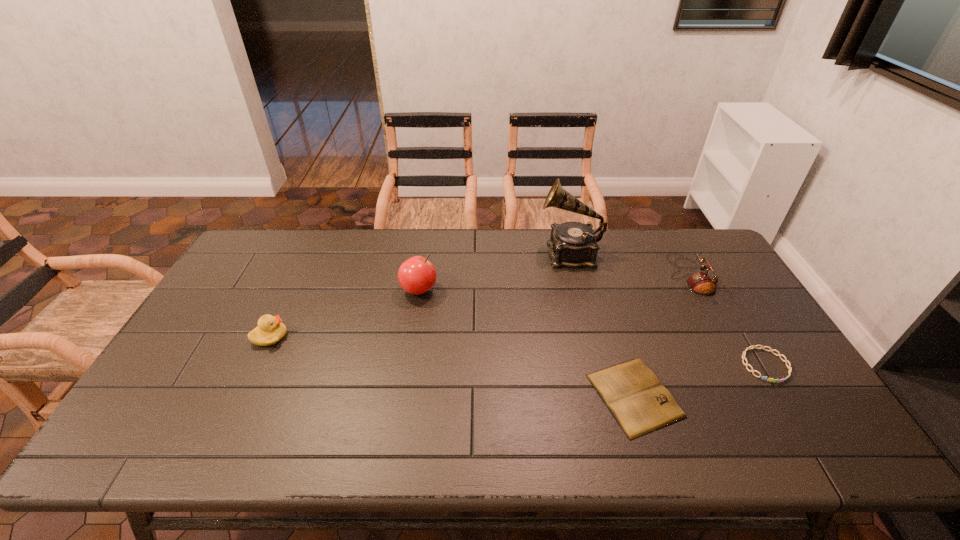
The height and width of the screenshot is (540, 960). I want to click on vacant area that lies between the bracelet and the phonograph record, so [x=667, y=309].

Find the location of a particular element. the fifth closest object relative to the tallest object is located at coordinates (270, 330).

Identify which object is the nearest to the apple. Please provide its 2D coordinates. Your answer should be formatted as a tuple, i.e. [(x, y)], where the tuple contains the x and y coordinates of a point satisfying the conditions above.

[(270, 330)]

The image size is (960, 540). I want to click on free spot that satisfies the following two spatial constraints: 1. on the beak of the book; 2. on the left side of the duckling, so click(242, 396).

Identify the location of free location that satisfies the following two spatial constraints: 1. on the rotary dial of the telephone; 2. on the front side of the book. This screenshot has width=960, height=540. (756, 396).

The height and width of the screenshot is (540, 960). I want to click on free space that satisfies the following two spatial constraints: 1. on the front side of the book; 2. on the right side of the second object from left to right, so click(403, 396).